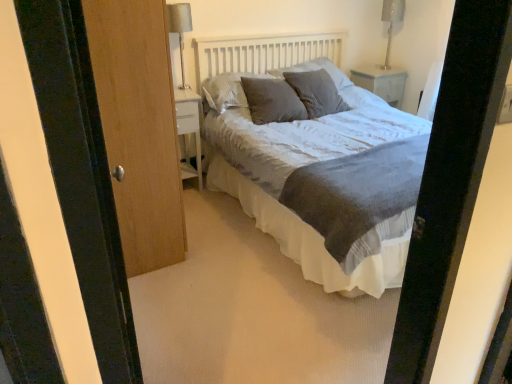
Identify the location of textured gray pillow at center, which is the first pillow from right to left. The height and width of the screenshot is (384, 512). (316, 92).

The height and width of the screenshot is (384, 512). I want to click on textured gray pillow at center, the third pillow from the left, so click(x=317, y=69).

Describe the element at coordinates (189, 129) in the screenshot. This screenshot has height=384, width=512. I see `white glossy nightstand at left, the first nightstand in the front-to-back sequence` at that location.

How much space does white glossy nightstand at left, which is the first nightstand in left-to-right order, occupy horizontally?

15.28 inches.

Find the location of a particular element. The image size is (512, 384). white glossy nightstand at upper right, arranged as the 2th nightstand when viewed from the front is located at coordinates (381, 82).

In order to face wooden door at left, should I rotate leftwards or rightwards?

Turn left by 15.904 degrees to look at wooden door at left.

I want to click on silver metallic table lamp at upper left, which appears as the first table lamp when viewed from the left, so click(x=180, y=29).

At what (x,y) coordinates should I click in order to perform the action: click on textured gray pillow at center, placed as the first pillow when sorted from left to right. Please return your answer as a coordinate pair (x, y). Looking at the image, I should click on (227, 91).

You are a GUI agent. You are given a task and a screenshot of the screen. Output one action in this format:
    pyautogui.click(x=<x>, y=<y>)
    Task: Click on the textured gray pillow at center, which is the first pillow from right to left
    
    Given the screenshot: What is the action you would take?
    pyautogui.click(x=316, y=92)

From the picture: Does wooden door at left appear on the left side of white glossy nightstand at left, which is the first nightstand in left-to-right order?

Incorrect, wooden door at left is not on the left side of white glossy nightstand at left, which is the first nightstand in left-to-right order.

The image size is (512, 384). Find the location of `door located below the white glossy nightstand at left, the second nightstand positioned from the back (from the image's perspective)`. door located below the white glossy nightstand at left, the second nightstand positioned from the back (from the image's perspective) is located at coordinates (139, 128).

Is wooden door at left oriented away from white glossy nightstand at left, the second nightstand positioned from the back?

That's not correct — wooden door at left is not looking away from white glossy nightstand at left, the second nightstand positioned from the back.

From the image's perspective, between white glossy nightstand at left, which is the first nightstand in left-to-right order, and metallic silver table lamp at upper right, the second table lamp viewed from the left, which one is located above?

metallic silver table lamp at upper right, the second table lamp viewed from the left, appears higher in the image.

Is point (180, 117) positioned in front of point (402, 7)?

Yes, point (180, 117) is in front of point (402, 7).

In terms of size, does white glossy nightstand at left, which is the first nightstand in left-to-right order, appear bigger or smaller than metallic silver table lamp at upper right, which is the first table lamp in right-to-left order?

Considering their sizes, white glossy nightstand at left, which is the first nightstand in left-to-right order, takes up more space than metallic silver table lamp at upper right, which is the first table lamp in right-to-left order.

Is white glossy nightstand at left, which is the second nightstand in top-to-bottom order, facing towards metallic silver table lamp at upper right, which appears as the second table lamp when viewed from the front?

No, white glossy nightstand at left, which is the second nightstand in top-to-bottom order, is not facing towards metallic silver table lamp at upper right, which appears as the second table lamp when viewed from the front.

From a real-world perspective, is textured gray pillow at center, the third pillow from the left, physically located above or below textured gray pillow at center, the fourth pillow positioned from the right?

Clearly, from a real-world perspective, textured gray pillow at center, the third pillow from the left, is above textured gray pillow at center, the fourth pillow positioned from the right.

Identify the location of pillow above the textured gray pillow at center, placed as the first pillow when sorted from left to right (from a real-world perspective). The image size is (512, 384). (317, 69).

Can you confirm if textured gray pillow at center, which is the 2th pillow from right to left, is bigger than textured gray pillow at center, placed as the first pillow when sorted from left to right?

Yes, textured gray pillow at center, which is the 2th pillow from right to left, is bigger than textured gray pillow at center, placed as the first pillow when sorted from left to right.

From the image's perspective, is textured gray pillow at center, the third pillow from the left, on top of textured gray pillow at center, placed as the first pillow when sorted from left to right?

Yes.

Who is shorter, textured gray pillow at center, positioned as the third pillow in right-to-left order, or textured gray pillow at center, the fourth pillow positioned from the right?

With less height is textured gray pillow at center, the fourth pillow positioned from the right.

Is textured gray pillow at center, the 2th pillow positioned from the left, wider or thinner than textured gray pillow at center, placed as the first pillow when sorted from left to right?

textured gray pillow at center, the 2th pillow positioned from the left, is wider than textured gray pillow at center, placed as the first pillow when sorted from left to right.

Consider the image. From a real-world perspective, between textured gray pillow at center, the 2th pillow positioned from the left, and textured gray pillow at center, the fourth pillow positioned from the right, who is vertically higher?

In real-world perspective, textured gray pillow at center, the fourth pillow positioned from the right, is above.

Considering the points (337, 76) and (97, 95), which point is behind, point (337, 76) or point (97, 95)?

Point (337, 76)

In the image, is textured gray pillow at center, the third pillow from the left, on the left side or the right side of wooden door at left?

From the image, it's evident that textured gray pillow at center, the third pillow from the left, is to the right of wooden door at left.

Is the surface of textured gray pillow at center, the third pillow from the left, in direct contact with wooden door at left?

They are not placed beside each other.

At what (x,y) coordinates should I click in order to perform the action: click on the 3rd pillow to the right when counting from the wooden door at left. Please return your answer as a coordinate pair (x, y). Looking at the image, I should click on (317, 69).

Is silver metallic table lamp at upper left, which is counted as the 2th table lamp, starting from the back, not within textured gray pillow at center, the fourth pillow positioned from the right?

Indeed, silver metallic table lamp at upper left, which is counted as the 2th table lamp, starting from the back, is completely outside textured gray pillow at center, the fourth pillow positioned from the right.

Considering the sizes of silver metallic table lamp at upper left, which is counted as the 2th table lamp, starting from the back, and textured gray pillow at center, placed as the first pillow when sorted from left to right, in the image, is silver metallic table lamp at upper left, which is counted as the 2th table lamp, starting from the back, taller or shorter than textured gray pillow at center, placed as the first pillow when sorted from left to right,?

In the image, silver metallic table lamp at upper left, which is counted as the 2th table lamp, starting from the back, appears to be taller than textured gray pillow at center, placed as the first pillow when sorted from left to right.

Are silver metallic table lamp at upper left, which appears as the first table lamp when viewed from the left, and textured gray pillow at center, the fourth pillow positioned from the right, beside each other?

No, silver metallic table lamp at upper left, which appears as the first table lamp when viewed from the left, is not touching textured gray pillow at center, the fourth pillow positioned from the right.

From a real-world perspective, who is located higher, silver metallic table lamp at upper left, which ranks as the 1th table lamp in front-to-back order, or textured gray pillow at center, placed as the first pillow when sorted from left to right?

In real-world perspective, silver metallic table lamp at upper left, which ranks as the 1th table lamp in front-to-back order, is above.

Considering the sizes of objects textured gray pillow at center, which is the first pillow from right to left, and wooden door at left in the image provided, who is thinner, textured gray pillow at center, which is the first pillow from right to left, or wooden door at left?

With smaller width is wooden door at left.

Which object is more forward, textured gray pillow at center, the 4th pillow positioned from the left, or wooden door at left?

Positioned in front is wooden door at left.

Is textured gray pillow at center, the 4th pillow positioned from the left, completely or partially outside of wooden door at left?

Absolutely, textured gray pillow at center, the 4th pillow positioned from the left, is external to wooden door at left.

At what (x,y) coordinates should I click in order to perform the action: click on the 1st nightstand positioned above the wooden door at left (from the image's perspective). Please return your answer as a coordinate pair (x, y). This screenshot has width=512, height=384. Looking at the image, I should click on (189, 129).

Locate an element on the screen. table lamp behind the white glossy nightstand at left, the first nightstand in the front-to-back sequence is located at coordinates (391, 23).

Based on their spatial positions, is textured gray pillow at center, the 2th pillow positioned from the left, or textured gray pillow at center, which is the 2th pillow from right to left, closer to textured gray pillow at center, the 4th pillow positioned from the left?

textured gray pillow at center, the 2th pillow positioned from the left, lies closer to textured gray pillow at center, the 4th pillow positioned from the left, than the other object.

Looking at the image, which one is located further to white glossy nightstand at upper right, the 2th nightstand from the left, wooden door at left or textured gray pillow at center, placed as the first pillow when sorted from left to right?

wooden door at left is positioned further to the anchor white glossy nightstand at upper right, the 2th nightstand from the left.

Which object lies further to the anchor point textured gray pillow at center, positioned as the third pillow in right-to-left order, white glossy nightstand at upper right, the 2th nightstand ordered from the bottom, or textured gray bed at center?

white glossy nightstand at upper right, the 2th nightstand ordered from the bottom, is further to textured gray pillow at center, positioned as the third pillow in right-to-left order.

Estimate the real-world distances between objects in this image. Which object is closer to white glossy nightstand at upper right, arranged as the 2th nightstand when viewed from the front, metallic silver table lamp at upper right, which appears as the second table lamp when viewed from the front, or textured gray pillow at center, placed as the first pillow when sorted from left to right?

Based on the image, metallic silver table lamp at upper right, which appears as the second table lamp when viewed from the front, appears to be nearer to white glossy nightstand at upper right, arranged as the 2th nightstand when viewed from the front.

Considering their positions, is textured gray pillow at center, the 4th pillow positioned from the left, positioned further to white glossy nightstand at left, the second nightstand positioned from the back, than white glossy nightstand at upper right, the first nightstand viewed from the back?

The object further to white glossy nightstand at left, the second nightstand positioned from the back, is white glossy nightstand at upper right, the first nightstand viewed from the back.

Which object lies further to the anchor point silver metallic table lamp at upper left, which appears as the first table lamp when viewed from the left, textured gray pillow at center, the 2th pillow positioned from the left, or metallic silver table lamp at upper right, which appears as the second table lamp when viewed from the front?

Based on the image, metallic silver table lamp at upper right, which appears as the second table lamp when viewed from the front, appears to be further to silver metallic table lamp at upper left, which appears as the first table lamp when viewed from the left.

Considering their positions, is textured gray pillow at center, positioned as the third pillow in right-to-left order, positioned closer to wooden door at left than textured gray pillow at center, the third pillow from the left?

Based on the image, textured gray pillow at center, positioned as the third pillow in right-to-left order, appears to be nearer to wooden door at left.

When comparing their distances from textured gray pillow at center, the 2th pillow positioned from the left, does textured gray pillow at center, which is the first pillow from right to left, or white glossy nightstand at left, the first nightstand in the front-to-back sequence, seem closer?

Based on the image, textured gray pillow at center, which is the first pillow from right to left, appears to be nearer to textured gray pillow at center, the 2th pillow positioned from the left.

You are a GUI agent. You are given a task and a screenshot of the screen. Output one action in this format:
    pyautogui.click(x=<x>, y=<y>)
    Task: Click on the nightstand between textured gray bed at center and white glossy nightstand at upper right, arranged as the 2th nightstand when viewed from the front, in the front-back direction
    
    Given the screenshot: What is the action you would take?
    click(x=189, y=129)

At what (x,y) coordinates should I click in order to perform the action: click on bed positioned between wooden door at left and metallic silver table lamp at upper right, which is the first table lamp in right-to-left order, from near to far. Please return your answer as a coordinate pair (x, y). Looking at the image, I should click on (323, 178).

Identify the location of nightstand between wooden door at left and textured gray pillow at center, the third pillow from the left, in the front-back direction. This screenshot has width=512, height=384. (189, 129).

Identify the location of nightstand between textured gray bed at center and textured gray pillow at center, the fourth pillow positioned from the right, from front to back. (189, 129).